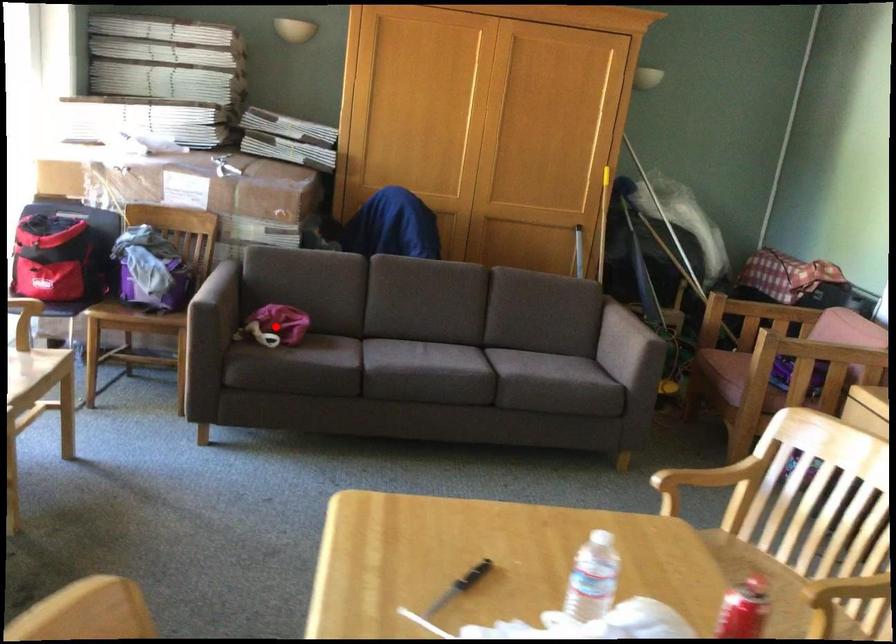
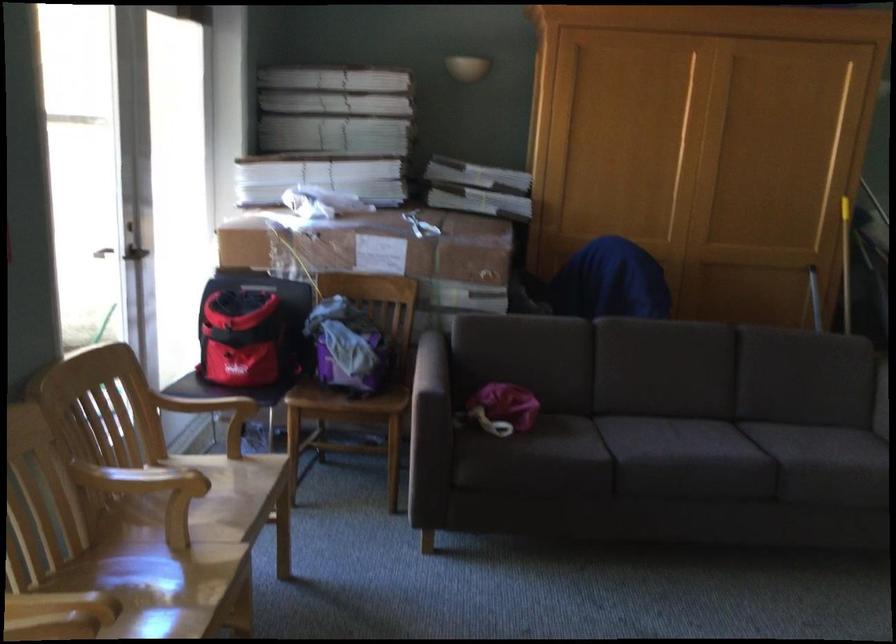
Where in the second image is the point corresponding to the highlighted location from the first image?

(503, 408)